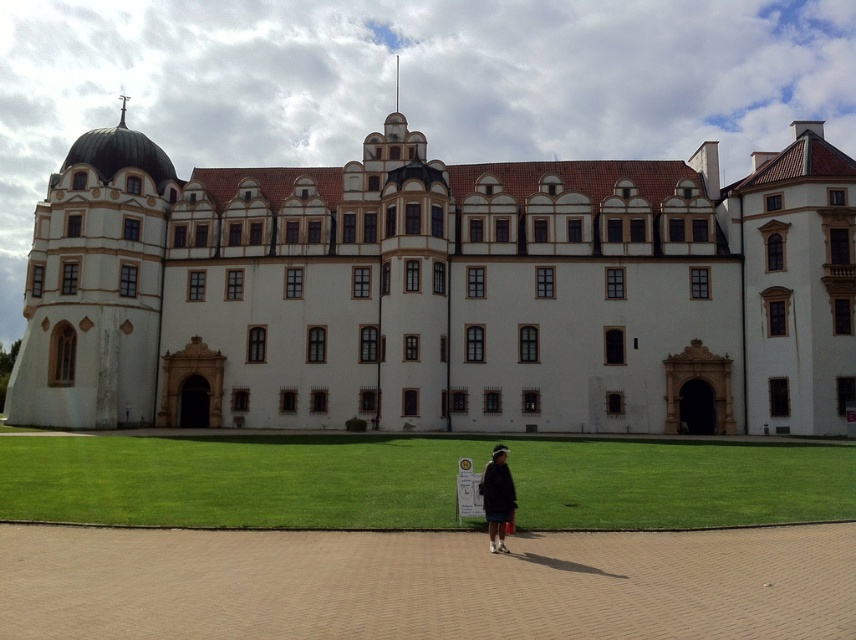
Does green grass at lower center have a smaller size compared to dark gray sweater at center?

Actually, green grass at lower center might be larger than dark gray sweater at center.

Does point (9, 512) lie in front of point (498, 467)?

No, it is not.

Who is more distant from viewer, (370,504) or (489,467)?

The point (370,504) is behind.

At what (x,y) coordinates should I click in order to perform the action: click on green grass at lower center. Please return your answer as a coordinate pair (x, y). Looking at the image, I should click on (235, 480).

How distant is white stone building at center from dark gray sweater at center?

white stone building at center and dark gray sweater at center are 28.51 meters apart.

Which is above, white stone building at center or dark gray sweater at center?

white stone building at center is higher up.

Where is `white stone building at center`? The height and width of the screenshot is (640, 856). white stone building at center is located at coordinates (441, 292).

Which is more to the right, white stone building at center or green grass at lower center?

From the viewer's perspective, white stone building at center appears more on the right side.

Is white stone building at center to the right of green grass at lower center from the viewer's perspective?

Yes, white stone building at center is to the right of green grass at lower center.

Find the location of a particular element. The height and width of the screenshot is (640, 856). white stone building at center is located at coordinates (441, 292).

The width and height of the screenshot is (856, 640). I want to click on white stone building at center, so click(441, 292).